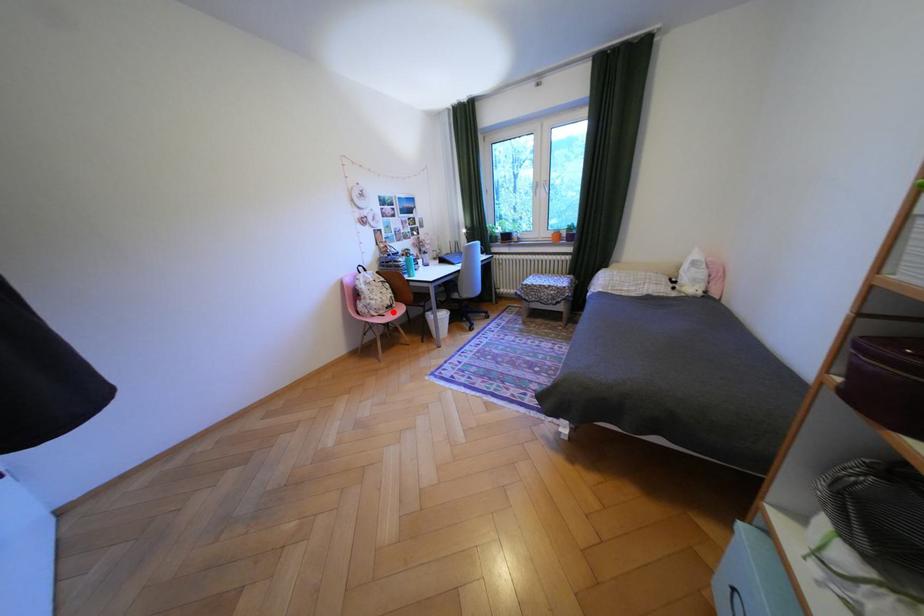
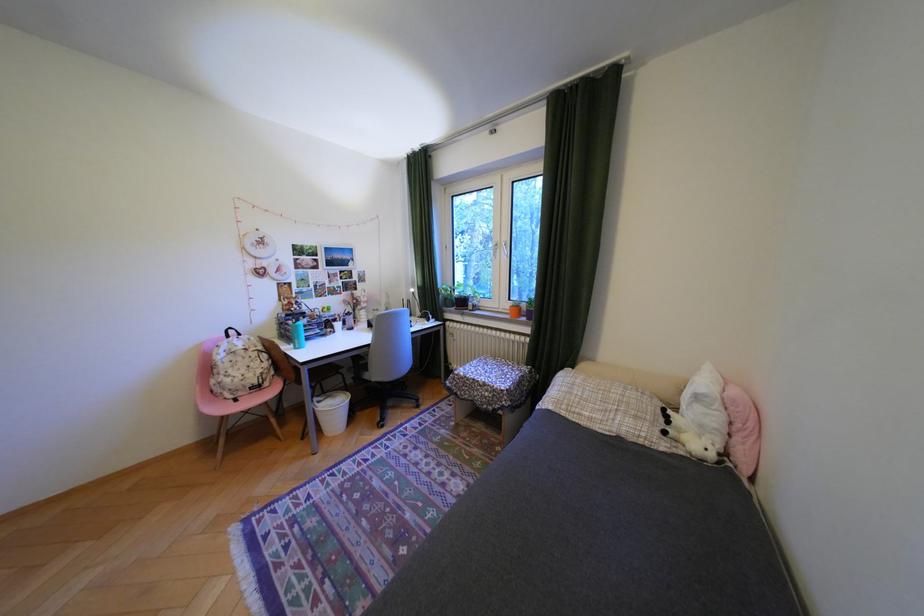
Question: I am providing you with two images of the same scene from different viewpoints. A red point is marked on the first image. Is the red point's position out of view in image 2?

Choices:
 (A) Yes
 (B) No

Answer: (B)